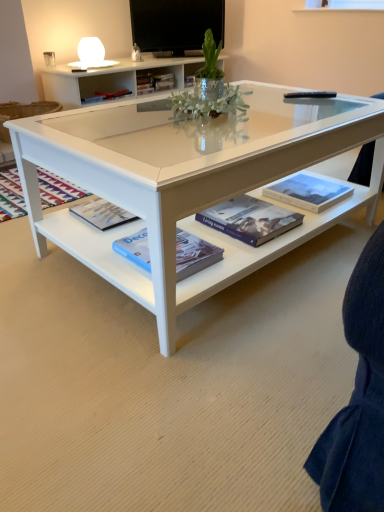
Image resolution: width=384 pixels, height=512 pixels. In order to click on green glass vase at center in this screenshot , I will do `click(209, 90)`.

What are the coordinates of `hardcover book at center, the third book when ordered from bottom to top` in the screenshot? It's located at point(308,192).

What do you see at coordinates (308, 192) in the screenshot? I see `hardcover book at center, the third book when ordered from bottom to top` at bounding box center [308, 192].

What is the approximate height of hardcover book at center, which is the fourth book in right-to-left order?

It is 4.27 centimeters.

This screenshot has width=384, height=512. What do you see at coordinates (188, 182) in the screenshot?
I see `white glossy coffee table at center` at bounding box center [188, 182].

Find the location of a particular element. This screenshot has width=384, height=512. flat screen tv at upper center is located at coordinates (176, 25).

You are a GUI agent. You are given a task and a screenshot of the screen. Output one action in this format:
    pyautogui.click(x=<x>, y=<y>)
    Task: Click on the green glass vase at center
    The height and width of the screenshot is (512, 384).
    Given the screenshot: What is the action you would take?
    click(x=209, y=90)

Is flat screen tv at upper center situated inside white glossy coffee table at center or outside?

flat screen tv at upper center cannot be found inside white glossy coffee table at center.

Can you confirm if flat screen tv at upper center is shorter than white glossy coffee table at center?

No.

Which object is closer to the camera taking this photo, flat screen tv at upper center or white glossy coffee table at center?

white glossy coffee table at center is closer to the camera.

Is point (159, 32) closer or farther from the camera than point (67, 174)?

Clearly, point (159, 32) is more distant from the camera than point (67, 174).

From the image's perspective, between hardcover book at center, placed as the fourth book when sorted from bottom to top, and blue hardcover book at center, the 4th book when ordered from top to bottom, which one is located above?

From the image's view, hardcover book at center, placed as the fourth book when sorted from bottom to top, is above.

Who is bigger, hardcover book at center, the 1th book viewed from the back, or blue hardcover book at center, the 3th book viewed from the right?

With larger size is blue hardcover book at center, the 3th book viewed from the right.

Does point (99, 97) come in front of point (204, 265)?

No, (99, 97) is further to viewer.

Consider the image. How much distance is there between hardcover book at center, acting as the first book starting from the top, and blue hardcover book at center, acting as the 1th book starting from the bottom?

5.96 feet.

From the picture: Between blue hardcover book at center, the 4th book when ordered from top to bottom, and hardcover book at lower left, which one has less height?

Standing shorter between the two is hardcover book at lower left.

From the image's perspective, would you say blue hardcover book at center, acting as the 1th book starting from the bottom, is shown under hardcover book at lower left?

Indeed, from the image's perspective, blue hardcover book at center, acting as the 1th book starting from the bottom, is shown beneath hardcover book at lower left.

Consider the image. Is blue hardcover book at center, the 3th book viewed from the right, at the left side of hardcover book at lower left?

No.

From the picture: Which object is further away from the camera, blue hardcover book at center, the 3th book viewed from the right, or flat screen tv at upper center?

flat screen tv at upper center.

Find the location of a particular element. This screenshot has width=384, height=512. window screen that appears behind the blue hardcover book at center, the 4th book when ordered from top to bottom is located at coordinates (176, 25).

From the picture: Does blue hardcover book at center, the 4th book when ordered from top to bottom, turn towards flat screen tv at upper center?

No, blue hardcover book at center, the 4th book when ordered from top to bottom, is not turned towards flat screen tv at upper center.

Who is shorter, blue hardcover book at center, the 4th book when ordered from top to bottom, or flat screen tv at upper center?

blue hardcover book at center, the 4th book when ordered from top to bottom, is shorter.

Considering the points (143, 116) and (258, 201), which point is in front, point (143, 116) or point (258, 201)?

Point (258, 201)

Is white glossy coffee table at center aimed at hardcover book at center, which is counted as the 2th book, starting from the right?

No, white glossy coffee table at center is not turned towards hardcover book at center, which is counted as the 2th book, starting from the right.

Can hardcover book at center, marked as the 3th book in a back-to-front arrangement, be found inside white glossy coffee table at center?

No, hardcover book at center, marked as the 3th book in a back-to-front arrangement, is not inside white glossy coffee table at center.

Can you tell me how much white glossy coffee table at center and hardcover book at center, arranged as the 3th book when viewed from the left, differ in facing direction?

177 degrees separate the facing orientations of white glossy coffee table at center and hardcover book at center, arranged as the 3th book when viewed from the left.

Which object is more forward, hardcover book at lower left or hardcover book at center, marked as the 3th book in a back-to-front arrangement?

hardcover book at center, marked as the 3th book in a back-to-front arrangement, is more forward.

From a real-world perspective, who is located lower, hardcover book at lower left or hardcover book at center, arranged as the 3th book when viewed from the left?

From a 3D spatial view, hardcover book at lower left is below.

From the image's perspective, is hardcover book at lower left positioned above or below hardcover book at center, placed as the 3th book when sorted from top to bottom?

hardcover book at lower left is situated higher than hardcover book at center, placed as the 3th book when sorted from top to bottom, in the image.

Would you say hardcover book at center, the first book from the left, is inside or outside hardcover book at center, marked as the 3th book in a back-to-front arrangement?

hardcover book at center, the first book from the left, cannot be found inside hardcover book at center, marked as the 3th book in a back-to-front arrangement.

Are hardcover book at center, the first book from the left, and hardcover book at center, placed as the 3th book when sorted from top to bottom, beside each other?

hardcover book at center, the first book from the left, and hardcover book at center, placed as the 3th book when sorted from top to bottom, are not in contact.

From a real-world perspective, is hardcover book at center, which is the fourth book in front-to-back order, located higher than hardcover book at center, the 2th book from the bottom?

Yes, from a real-world perspective, hardcover book at center, which is the fourth book in front-to-back order, is above hardcover book at center, the 2th book from the bottom.

Which of these two, hardcover book at center, placed as the fourth book when sorted from bottom to top, or hardcover book at center, placed as the 3th book when sorted from top to bottom, stands taller?

Standing taller between the two is hardcover book at center, placed as the fourth book when sorted from bottom to top.

Image resolution: width=384 pixels, height=512 pixels. Identify the location of window screen above the white glossy coffee table at center (from a real-world perspective). (176, 25).

Which book is the 1st one when counting from the right side of the hardcover book at center, which is the fourth book in front-to-back order? Please provide its 2D coordinates.

[(194, 254)]

Based on their spatial positions, is hardcover book at center, arranged as the 3th book when viewed from the left, or flat screen tv at upper center closer to hardcover book at center, acting as the 4th book starting from the left?

Based on the image, hardcover book at center, arranged as the 3th book when viewed from the left, appears to be nearer to hardcover book at center, acting as the 4th book starting from the left.

From the image, which object appears to be nearer to green glass vase at center, flat screen tv at upper center or hardcover book at lower left?

hardcover book at lower left is closer to green glass vase at center.

Based on their spatial positions, is hardcover book at center, marked as the 1th book in a right-to-left arrangement, or flat screen tv at upper center further from hardcover book at lower left?

flat screen tv at upper center.

Based on their spatial positions, is hardcover book at lower left or hardcover book at center, marked as the 1th book in a right-to-left arrangement, further from blue hardcover book at center, the 3th book viewed from the right?

hardcover book at center, marked as the 1th book in a right-to-left arrangement, is further to blue hardcover book at center, the 3th book viewed from the right.

Looking at the image, which one is located further to green glass vase at center, flat screen tv at upper center or hardcover book at center, arranged as the 3th book when viewed from the left?

Based on the image, flat screen tv at upper center appears to be further to green glass vase at center.

From the image, which object appears to be nearer to hardcover book at lower left, flat screen tv at upper center or green glass vase at center?

Based on the image, green glass vase at center appears to be nearer to hardcover book at lower left.

Based on their spatial positions, is white glossy coffee table at center or flat screen tv at upper center closer to hardcover book at center, which is counted as the 2th book, starting from the right?

Based on the image, white glossy coffee table at center appears to be nearer to hardcover book at center, which is counted as the 2th book, starting from the right.

Which object lies nearer to the anchor point hardcover book at center, the third book when ordered from bottom to top, blue hardcover book at center, acting as the 1th book starting from the bottom, or hardcover book at center, acting as the first book starting from the top?

Based on the image, blue hardcover book at center, acting as the 1th book starting from the bottom, appears to be nearer to hardcover book at center, the third book when ordered from bottom to top.

I want to click on floral arrangement between white glossy coffee table at center and hardcover book at lower left along the z-axis, so click(x=209, y=90).

At what (x,y) coordinates should I click in order to perform the action: click on book positioned between white glossy coffee table at center and hardcover book at center, the second book positioned from the front, from near to far. Please return your answer as a coordinate pair (x, y). Looking at the image, I should click on (194, 254).

This screenshot has width=384, height=512. I want to click on paperback book between green glass vase at center and flat screen tv at upper center in the front-back direction, so click(x=103, y=214).

Locate an element on the screen. book positioned between white glossy coffee table at center and green glass vase at center from near to far is located at coordinates (194, 254).